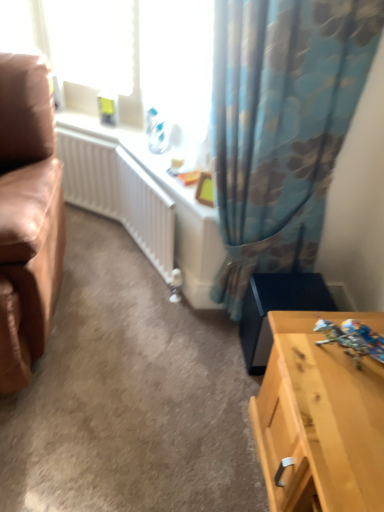
Question: Is floral fabric curtain at upper right completely or partially inside light wood table at lower right?

Choices:
 (A) yes
 (B) no

Answer: (B)

Question: From a real-world perspective, is light wood table at lower right below floral fabric curtain at upper right?

Choices:
 (A) no
 (B) yes

Answer: (B)

Question: From the image's perspective, is light wood table at lower right above floral fabric curtain at upper right?

Choices:
 (A) no
 (B) yes

Answer: (A)

Question: Is light wood table at lower right shorter than floral fabric curtain at upper right?

Choices:
 (A) no
 (B) yes

Answer: (B)

Question: Does light wood table at lower right have a greater width compared to floral fabric curtain at upper right?

Choices:
 (A) yes
 (B) no

Answer: (A)

Question: Is light wood table at lower right at the left side of floral fabric curtain at upper right?

Choices:
 (A) yes
 (B) no

Answer: (B)

Question: Is light wood table at lower right to the left of leather at left from the viewer's perspective?

Choices:
 (A) yes
 (B) no

Answer: (B)

Question: Would you say light wood table at lower right contains leather at left?

Choices:
 (A) yes
 (B) no

Answer: (B)

Question: Is light wood table at lower right positioned in front of leather at left?

Choices:
 (A) yes
 (B) no

Answer: (B)

Question: Can you confirm if light wood table at lower right is thinner than leather at left?

Choices:
 (A) no
 (B) yes

Answer: (B)

Question: Considering the relative sizes of light wood table at lower right and leather at left in the image provided, is light wood table at lower right wider than leather at left?

Choices:
 (A) yes
 (B) no

Answer: (B)

Question: Is light wood table at lower right to the right of leather at left from the viewer's perspective?

Choices:
 (A) no
 (B) yes

Answer: (B)

Question: Can you confirm if leather at left is positioned to the left of floral fabric curtain at upper right?

Choices:
 (A) yes
 (B) no

Answer: (A)